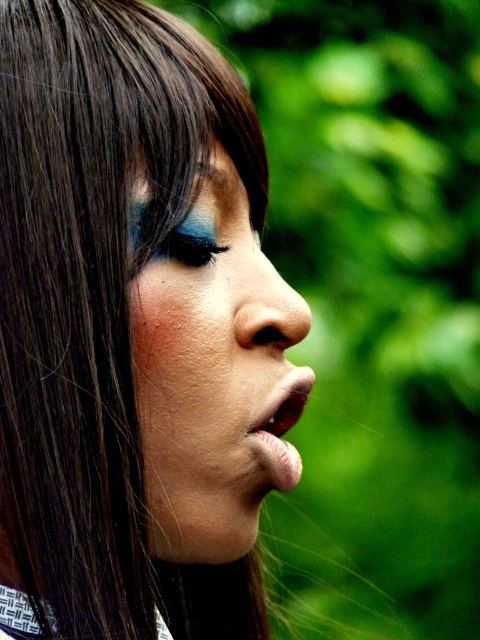
Question: Which of the following is the closest to the observer?

Choices:
 (A) (140, 371)
 (B) (192, 227)

Answer: (A)

Question: From the image, what is the correct spatial relationship of brown skin freckle at lower center in relation to matte black eyebrow at upper center?

Choices:
 (A) right
 (B) left

Answer: (B)

Question: Observing the image, what is the correct spatial positioning of matte skin face at center in reference to brown skin freckle at lower center?

Choices:
 (A) right
 (B) left

Answer: (A)

Question: Does matte skin face at center appear over matte black eyebrow at upper center?

Choices:
 (A) no
 (B) yes

Answer: (A)

Question: Which point is closer to the camera taking this photo?

Choices:
 (A) click(x=238, y=179)
 (B) click(x=172, y=308)
 (C) click(x=158, y=252)
 (D) click(x=195, y=428)

Answer: (B)

Question: Among these objects, which one is nearest to the camera?

Choices:
 (A) matte black eyebrow at upper center
 (B) brown skin freckle at lower center
 (C) shiny blue eyeshadow at upper center

Answer: (B)